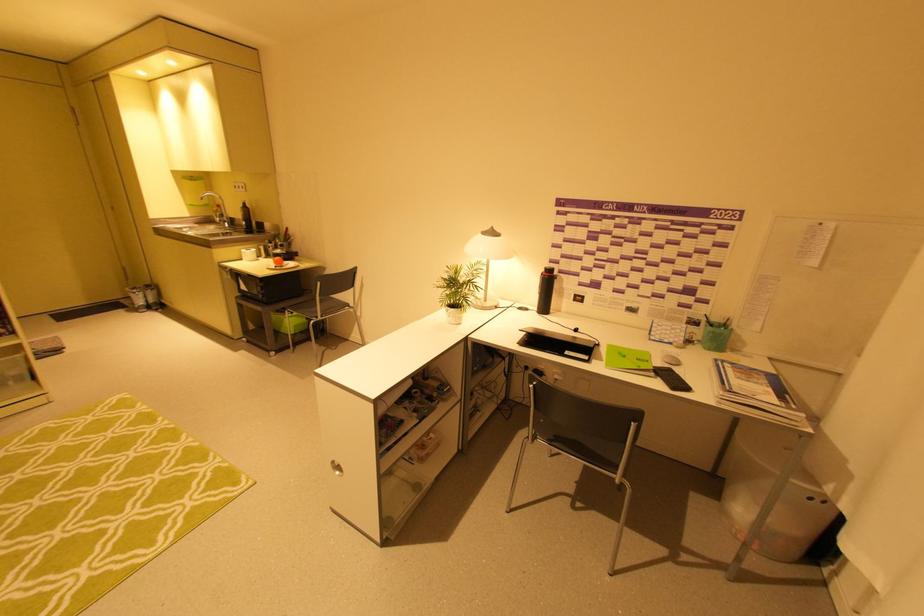
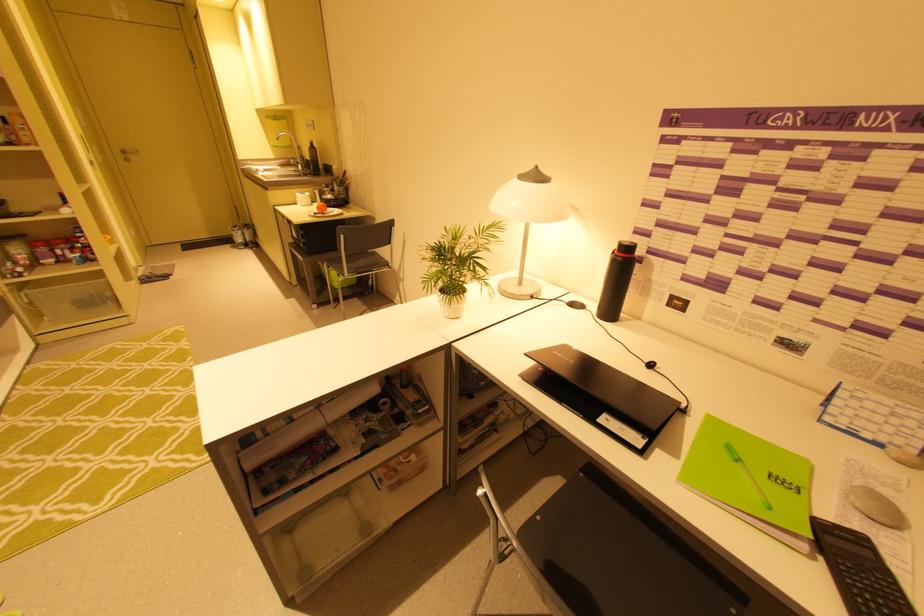
Find the pixel in the second image that matches pixel 546 270 in the first image.

(619, 248)